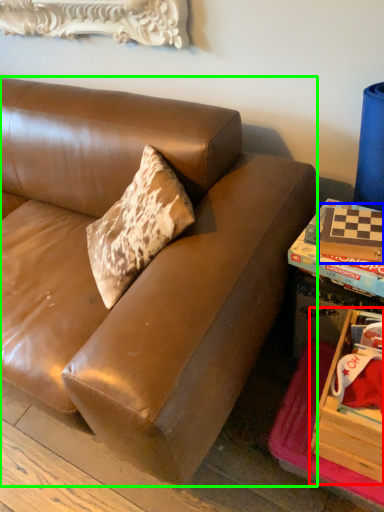
Question: Which object is the farthest from storage box (highlighted by a red box)? Choose among these: book (highlighted by a blue box) or studio couch (highlighted by a green box).

Choices:
 (A) book
 (B) studio couch

Answer: (B)